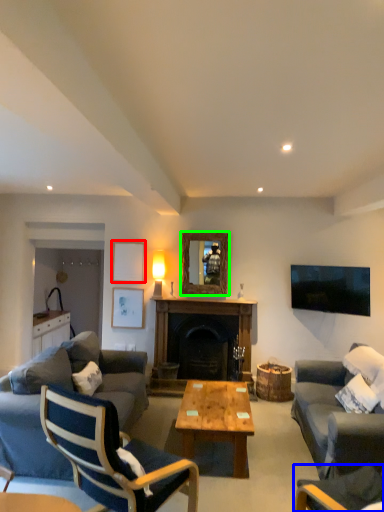
Question: Which object is the closest to the picture frame (highlighted by a red box)? Choose among these: chair (highlighted by a blue box) or mirror (highlighted by a green box).

Choices:
 (A) chair
 (B) mirror

Answer: (B)